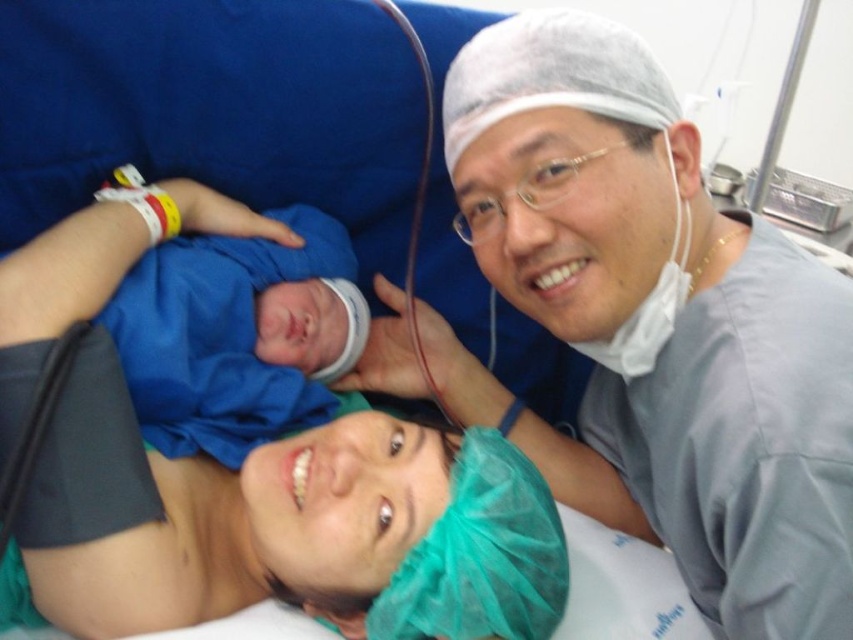
Between point (476, 141) and point (247, 317), which one is positioned in front?

Positioned in front is point (476, 141).

From the picture: Measure the distance between gray scrubs at upper right and blue fabric swaddle at center.

gray scrubs at upper right and blue fabric swaddle at center are 29.05 centimeters apart.

Does point (601, 448) come behind point (263, 397)?

Yes, point (601, 448) is farther from viewer.

Identify the location of gray scrubs at upper right. Image resolution: width=853 pixels, height=640 pixels. (654, 324).